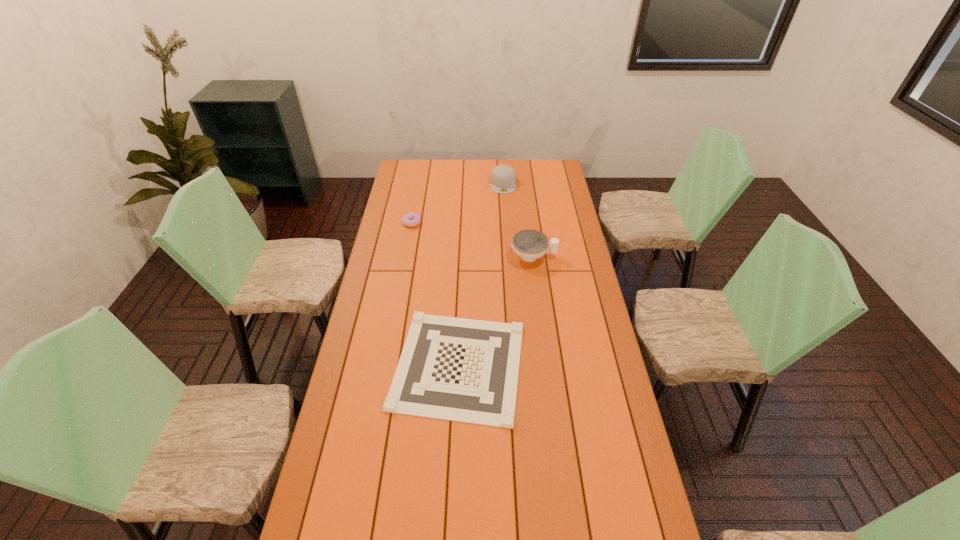
This screenshot has width=960, height=540. I want to click on object located in the far edge section of the desktop, so click(503, 178).

Image resolution: width=960 pixels, height=540 pixels. I want to click on doughnut that is at the left edge, so click(x=412, y=219).

You are a GUI agent. You are given a task and a screenshot of the screen. Output one action in this format:
    pyautogui.click(x=<x>, y=<y>)
    Task: Click on the checkerboard located in the left edge section of the desktop
    
    Given the screenshot: What is the action you would take?
    pyautogui.click(x=465, y=370)

This screenshot has width=960, height=540. I want to click on object present at the right edge, so click(x=530, y=245).

This screenshot has width=960, height=540. I want to click on free space at the far edge of the desktop, so click(469, 175).

This screenshot has width=960, height=540. Find the location of `vacant space at the left edge`. vacant space at the left edge is located at coordinates (386, 280).

The width and height of the screenshot is (960, 540). Find the location of `vacant area at the right edge of the desktop`. vacant area at the right edge of the desktop is located at coordinates click(562, 245).

Identify the location of free space between the second farthest object and the cap. (458, 203).

The height and width of the screenshot is (540, 960). What are the coordinates of `free space between the cap and the chinaware` in the screenshot? It's located at (518, 220).

This screenshot has width=960, height=540. In order to click on free spot between the third tallest object and the second nearest object in this screenshot , I will do `click(472, 239)`.